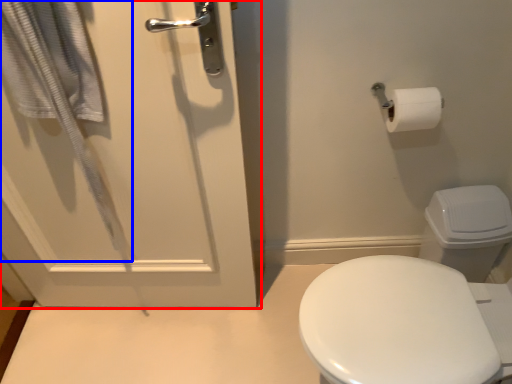
Question: Which point is further to the camera, door (highlighted by a red box) or bath towel (highlighted by a blue box)?

Choices:
 (A) door
 (B) bath towel

Answer: (A)